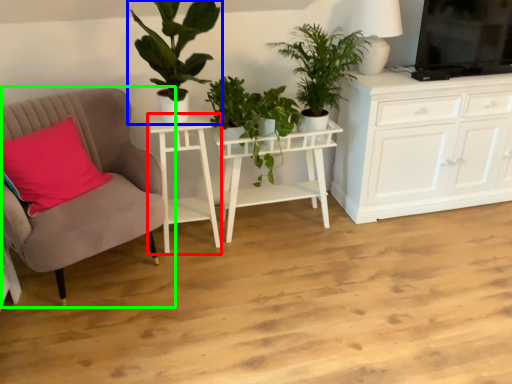
Question: Which is farther away from table (highlighted by a red box)? houseplant (highlighted by a blue box) or chair (highlighted by a green box)?

Choices:
 (A) houseplant
 (B) chair

Answer: (A)